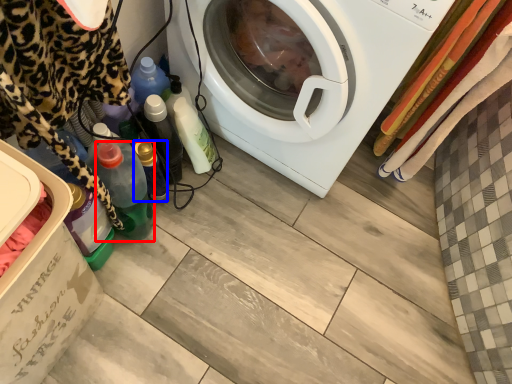
Question: Which object appears closest to the camera in this image, bottle (highlighted by a red box) or bottle (highlighted by a blue box)?

Choices:
 (A) bottle
 (B) bottle

Answer: (A)